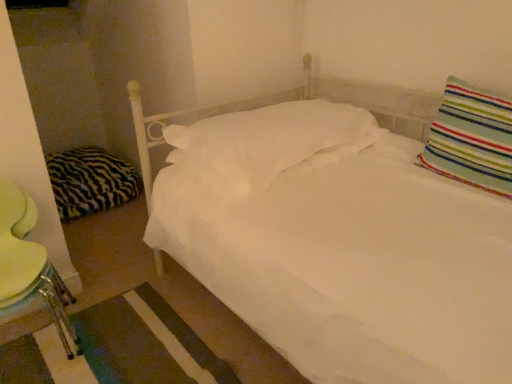
Question: From a real-world perspective, is zebra-patterned fabric pillow at left, the third pillow in the right-to-left sequence, beneath white soft pillow at center, which ranks as the second pillow in right-to-left order?

Choices:
 (A) yes
 (B) no

Answer: (A)

Question: Does zebra-patterned fabric pillow at left, the first pillow positioned from the back, have a greater height compared to white soft pillow at center, placed as the 2th pillow when sorted from left to right?

Choices:
 (A) no
 (B) yes

Answer: (B)

Question: Does zebra-patterned fabric pillow at left, acting as the 1th pillow starting from the left, lie in front of white soft pillow at center, the 2th pillow when ordered from front to back?

Choices:
 (A) yes
 (B) no

Answer: (B)

Question: Can you see zebra-patterned fabric pillow at left, the third pillow in the right-to-left sequence, touching white soft pillow at center, the 2th pillow viewed from the back?

Choices:
 (A) no
 (B) yes

Answer: (A)

Question: Is zebra-patterned fabric pillow at left, the third pillow in the right-to-left sequence, aimed at white soft pillow at center, which ranks as the second pillow in right-to-left order?

Choices:
 (A) yes
 (B) no

Answer: (B)

Question: Is zebra-patterned fabric pillow at left, the third pillow in the right-to-left sequence, wider than white soft pillow at center, placed as the 2th pillow when sorted from left to right?

Choices:
 (A) yes
 (B) no

Answer: (B)

Question: From a real-world perspective, is metallic green swivel chair at lower left physically above white soft pillow at center, which ranks as the second pillow in right-to-left order?

Choices:
 (A) yes
 (B) no

Answer: (B)

Question: From the image's perspective, is metallic green swivel chair at lower left under white soft pillow at center, the 2th pillow when ordered from front to back?

Choices:
 (A) no
 (B) yes

Answer: (B)

Question: Is metallic green swivel chair at lower left wider than white soft pillow at center, the 2th pillow when ordered from front to back?

Choices:
 (A) yes
 (B) no

Answer: (B)

Question: Is metallic green swivel chair at lower left smaller than white soft pillow at center, the 2th pillow when ordered from front to back?

Choices:
 (A) yes
 (B) no

Answer: (A)

Question: Is metallic green swivel chair at lower left positioned with its back to white soft pillow at center, placed as the 2th pillow when sorted from left to right?

Choices:
 (A) yes
 (B) no

Answer: (B)

Question: Considering the relative positions of metallic green swivel chair at lower left and white soft pillow at center, the 2th pillow when ordered from front to back, in the image provided, is metallic green swivel chair at lower left to the left of white soft pillow at center, the 2th pillow when ordered from front to back, from the viewer's perspective?

Choices:
 (A) yes
 (B) no

Answer: (A)

Question: Does zebra-patterned fabric pillow at left, acting as the 1th pillow starting from the left, have a lesser height compared to striped fabric pillow at upper right, which appears as the third pillow when viewed from the left?

Choices:
 (A) no
 (B) yes

Answer: (B)